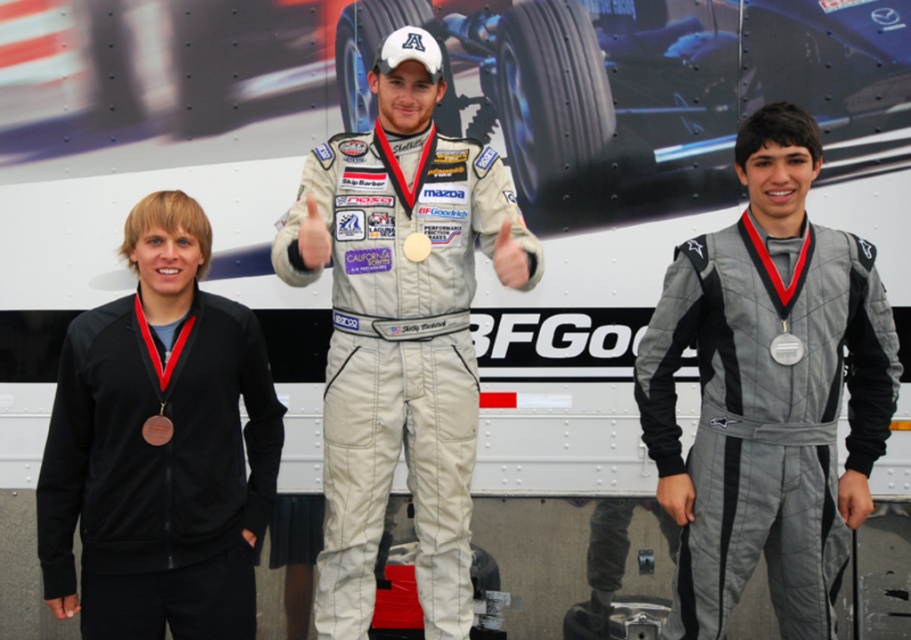
Where is the matte white racing suit at center located in the image?

The matte white racing suit at center is located at point coordinates of (401,330).

Based on the scene description, which object is taller between the matte white racing suit at center and the gold metallic medal at center?

The matte white racing suit at center is taller than the gold metallic medal at center according to the description.

You are a photographer at this event and need to arrange the participants for a group photo. The director wants the quilted gray jumpsuit at center and the gold metallic medal at center to be clearly visible. Based on their current positions, which one is on the right side so it can be highlighted in the photo?

The quilted gray jumpsuit at center is positioned on the right side of the gold metallic medal at center, so it can be highlighted in the photo.